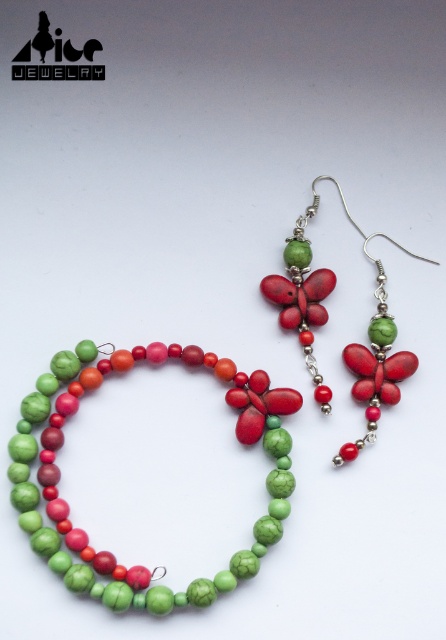
Between matte ceramic beads at center and matte red butterfly at center, which one has less height?

Standing shorter between the two is matte red butterfly at center.

Is point (289, 408) more distant than point (310, 275)?

No, it is in front of (310, 275).

The image size is (446, 640). Identify the location of matte ceramic beads at center. (x=67, y=502).

Is matte ceramic beads at center shorter than green matte beads at center?

In fact, matte ceramic beads at center may be taller than green matte beads at center.

Which is in front, point (107, 369) or point (256, 371)?

Point (107, 369)

Where is `matte ceramic beads at center`? This screenshot has width=446, height=640. matte ceramic beads at center is located at coordinates (67, 502).

How far apart are green matte beads at center and matte red butterfly at center?

green matte beads at center is 9.05 inches from matte red butterfly at center.

Can you confirm if green matte beads at center is shorter than matte red butterfly at center?

Yes, green matte beads at center is shorter than matte red butterfly at center.

Does point (78, 586) lie in front of point (375, 432)?

Yes, it is.

Locate an element on the screen. green matte beads at center is located at coordinates (67, 504).